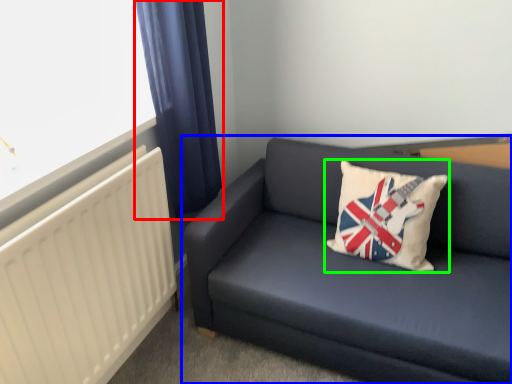
Question: Which object is positioned farthest from curtain (highlighted by a red box)? Select from studio couch (highlighted by a blue box) and pillow (highlighted by a green box).

Choices:
 (A) studio couch
 (B) pillow

Answer: (B)